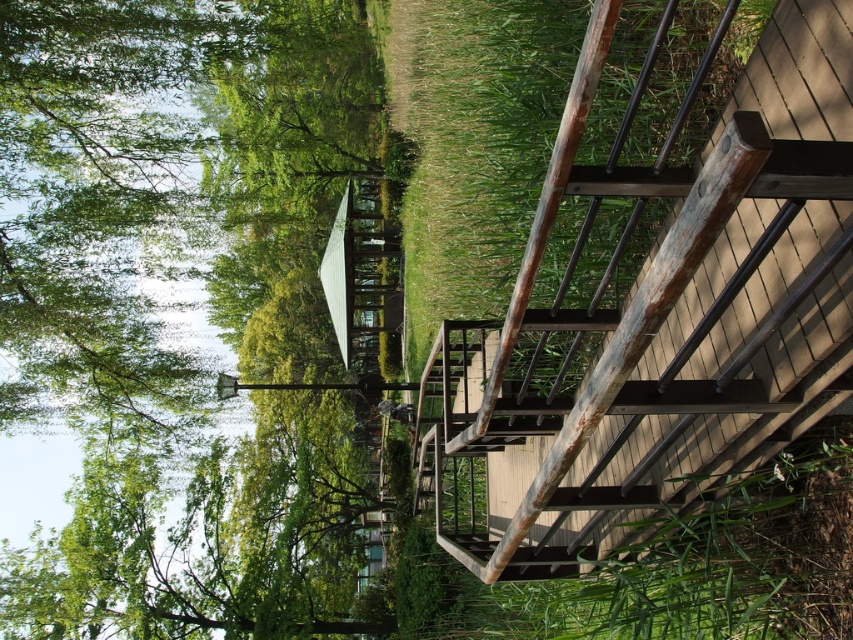
Question: Which point appears closest to the camera in this image?

Choices:
 (A) (199, 221)
 (B) (558, 458)

Answer: (B)

Question: Which object appears farthest from the camera in this image?

Choices:
 (A) green leafy tree at upper left
 (B) rustic wood stairwell at upper right

Answer: (A)

Question: Is green leafy tree at upper left positioned before rustic wood stairwell at upper right?

Choices:
 (A) no
 (B) yes

Answer: (A)

Question: Is green leafy tree at upper left wider than rustic wood stairwell at upper right?

Choices:
 (A) yes
 (B) no

Answer: (A)

Question: Does green leafy tree at upper left come behind rustic wood stairwell at upper right?

Choices:
 (A) yes
 (B) no

Answer: (A)